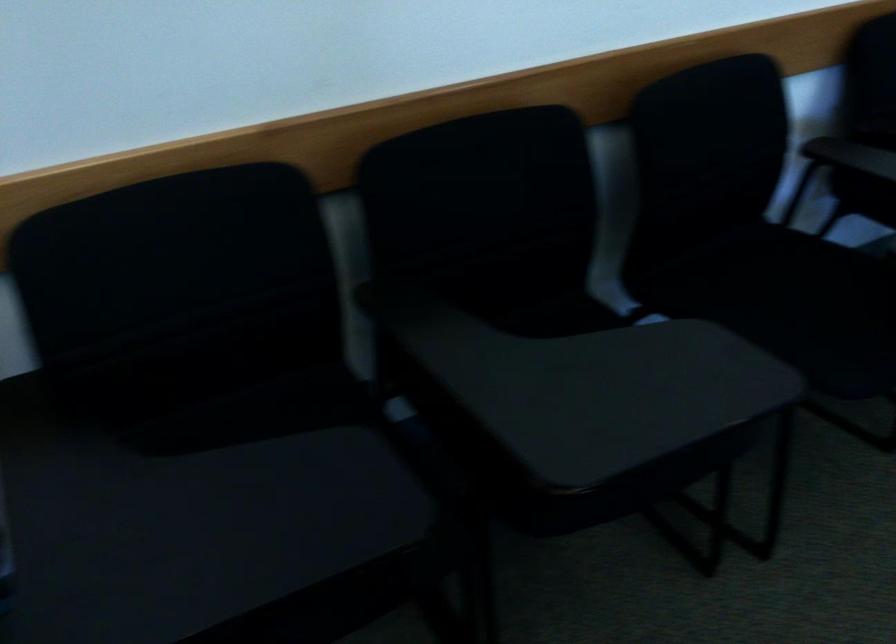
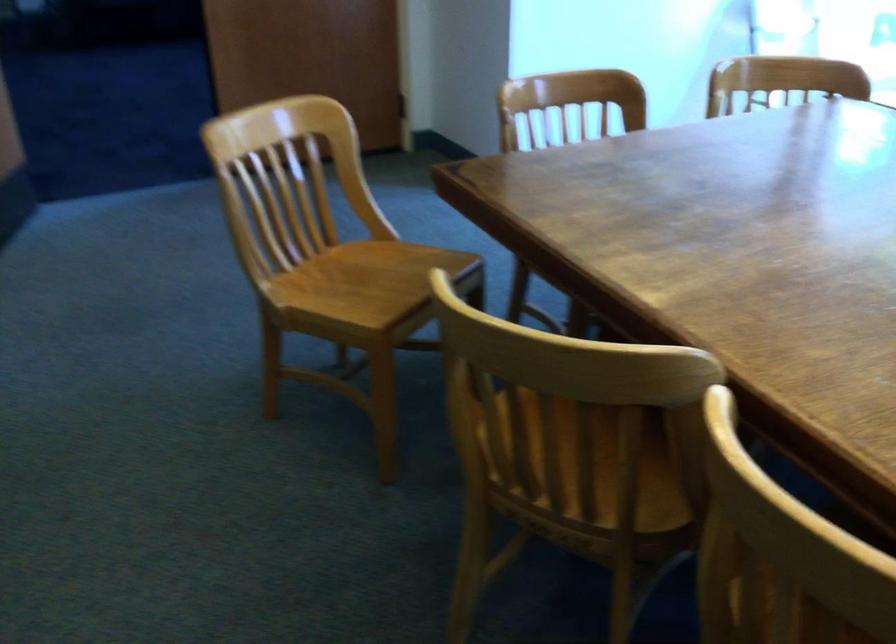
How did the camera likely rotate?

The camera's rotation is toward right-down.